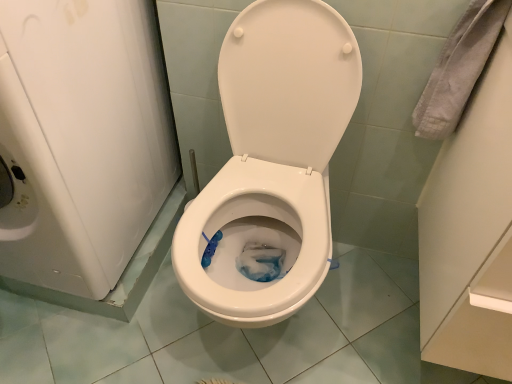
The width and height of the screenshot is (512, 384). What are the coordinates of `white glossy toilet at center` in the screenshot? It's located at (272, 159).

What do you see at coordinates (272, 159) in the screenshot? I see `white glossy toilet at center` at bounding box center [272, 159].

Where is `white glossy washing machine at left`? The width and height of the screenshot is (512, 384). white glossy washing machine at left is located at coordinates pos(82,139).

What do you see at coordinates (82, 139) in the screenshot? I see `white glossy washing machine at left` at bounding box center [82, 139].

Locate an element on the screen. Image resolution: width=512 pixels, height=384 pixels. white glossy toilet at center is located at coordinates (272, 159).

Does white glossy washing machine at left appear on the left side of white glossy toilet at center?

Yes.

Is white glossy washing machine at left further to the viewer compared to white glossy toilet at center?

No, white glossy washing machine at left is in front of white glossy toilet at center.

Which point is more distant from viewer, (59, 153) or (284, 14)?

Point (284, 14)

From the image's perspective, which is below, white glossy washing machine at left or white glossy toilet at center?

From the image's view, white glossy toilet at center is below.

From a real-world perspective, does white glossy washing machine at left sit lower than white glossy toilet at center?

No, from a real-world perspective, white glossy washing machine at left is not under white glossy toilet at center.

Looking at their sizes, would you say white glossy washing machine at left is wider or thinner than white glossy toilet at center?

Considering their sizes, white glossy washing machine at left looks broader than white glossy toilet at center.

From the picture: Who is taller, white glossy washing machine at left or white glossy toilet at center?

white glossy washing machine at left.

Based on the photo, can you confirm if white glossy washing machine at left is smaller than white glossy toilet at center?

Incorrect, white glossy washing machine at left is not smaller in size than white glossy toilet at center.

Do you think white glossy washing machine at left is within white glossy toilet at center, or outside of it?

white glossy washing machine at left is outside white glossy toilet at center.

Is white glossy washing machine at left directly adjacent to white glossy toilet at center?

No, white glossy washing machine at left is not in contact with white glossy toilet at center.

Could you tell me if white glossy washing machine at left is turned towards white glossy toilet at center?

No, white glossy washing machine at left is not oriented towards white glossy toilet at center.

Based on the photo, how many degrees apart are the facing directions of white glossy washing machine at left and white glossy toilet at center?

There is a 1.27e-05-degree angle between the facing directions of white glossy washing machine at left and white glossy toilet at center.

Where is `appliance above the white glossy toilet at center (from a real-world perspective)`? This screenshot has height=384, width=512. appliance above the white glossy toilet at center (from a real-world perspective) is located at coordinates (82, 139).

Which is more to the right, white glossy toilet at center or white glossy washing machine at left?

Positioned to the right is white glossy toilet at center.

Is white glossy toilet at center further to the viewer compared to white glossy washing machine at left?

Yes, white glossy toilet at center is behind white glossy washing machine at left.

From the picture: Which point is more forward, (353, 53) or (62, 178)?

The point (62, 178) is more forward.

From the picture: From the image's perspective, who appears lower, white glossy toilet at center or white glossy washing machine at left?

white glossy toilet at center is shown below in the image.

From a real-world perspective, is white glossy toilet at center on top of white glossy washing machine at left?

No, from a real-world perspective, white glossy toilet at center is not over white glossy washing machine at left

Considering the sizes of white glossy toilet at center and white glossy washing machine at left in the image, is white glossy toilet at center wider or thinner than white glossy washing machine at left?

Considering their sizes, white glossy toilet at center looks slimmer than white glossy washing machine at left.

Who is shorter, white glossy toilet at center or white glossy washing machine at left?

white glossy toilet at center.

Is white glossy toilet at center bigger or smaller than white glossy washing machine at left?

Clearly, white glossy toilet at center is smaller in size than white glossy washing machine at left.

Is white glossy toilet at center not inside white glossy washing machine at left?

Yes, white glossy toilet at center is located beyond the bounds of white glossy washing machine at left.

Would you consider white glossy toilet at center to be distant from white glossy washing machine at left?

Actually, white glossy toilet at center and white glossy washing machine at left are a little close together.

Could you tell me if white glossy toilet at center is turned towards white glossy washing machine at left?

No, white glossy toilet at center does not turn towards white glossy washing machine at left.

This screenshot has width=512, height=384. In the image, there is a white glossy toilet at center. In order to click on appliance above it (from the image's perspective) in this screenshot , I will do `click(82, 139)`.

You are a GUI agent. You are given a task and a screenshot of the screen. Output one action in this format:
    pyautogui.click(x=<x>, y=<y>)
    Task: Click on the toilet that appears on the right of white glossy washing machine at left
    This screenshot has height=384, width=512.
    Given the screenshot: What is the action you would take?
    pyautogui.click(x=272, y=159)

Identify the location of appliance above the white glossy toilet at center (from the image's perspective). The height and width of the screenshot is (384, 512). (82, 139).